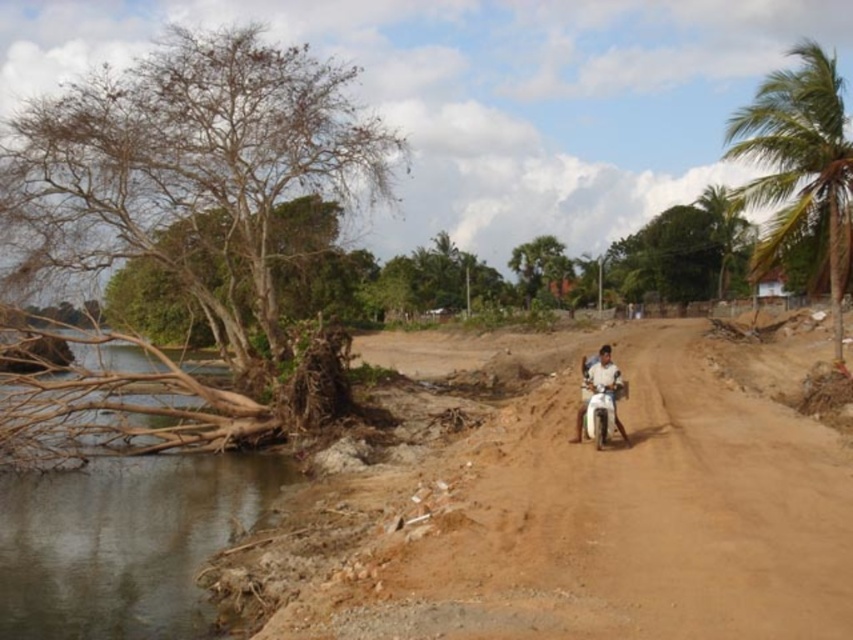
You are a photographer planning to capture a landscape shot of the scene. You want to ensure both the green leafy palm tree at right and the green leafy tree at center are in the frame. Based on their widths, which tree should you focus on to ensure both fit comfortably in your shot?

The green leafy palm tree at right might be wider than the green leafy tree at center, so focusing on the palm tree would ensure both fit comfortably in the shot.

Looking at this image, you are a hiker who wants to take a photo of both the green leafy palm tree at right and the green leafy tree at center. Which tree should you stand closer to in order to capture both in a single frame?

Since the green leafy palm tree at right is larger than the green leafy tree at center, you should stand closer to the green leafy tree at center to include both in the frame.

You are a hiker who wants to know which object is taller between the brown sandy dirt track at center and the green leafy tree at center. Based on the scene, can you tell me which one is taller?

The green leafy tree at center is taller than the brown sandy dirt track at center according to the description.